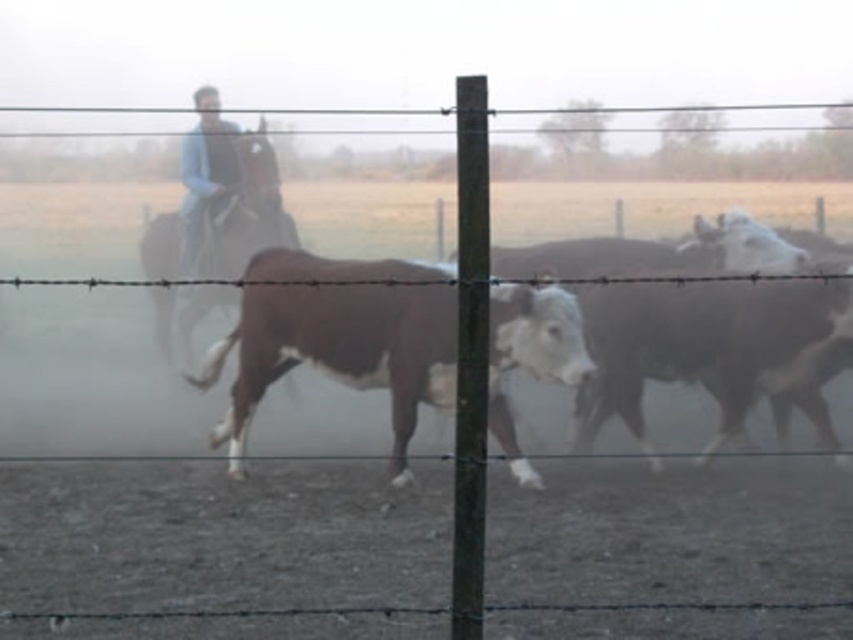
You are a farmer trying to identify your cattle. You notice two cows in the image. Which cow is positioned lower in the scene, the brown speckled hide at center or the brown glossy cow at center?

The brown speckled hide at center is located below the brown glossy cow at center, so it is positioned lower in the scene.

You are a farmer trying to count your cattle. You see the brown speckled hide at center and the brown glossy horse at left. Which one is closer to you?

The brown speckled hide at center is closer to you because it is in front of the brown glossy horse at left.

You are a farmer guiding your herd. You notice the brown speckled hide at center and the brown glossy horse at left. Which animal is positioned closer to the right side of the scene?

The brown speckled hide at center is to the right of the brown glossy horse at left, so it is closer to the right side of the scene.